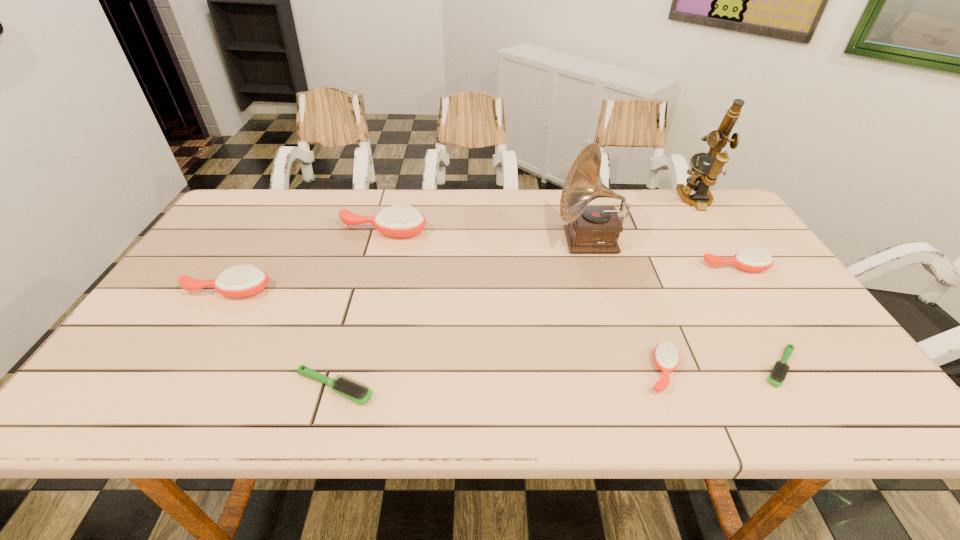
The image size is (960, 540). I want to click on the nearest orange hairbrush, so click(666, 357).

The width and height of the screenshot is (960, 540). Identify the location of the left light hairbrush. (351, 390).

This screenshot has height=540, width=960. Identify the location of the bigger light hairbrush. (351, 390).

Locate an element on the screen. the shortest object is located at coordinates (777, 377).

Image resolution: width=960 pixels, height=540 pixels. I want to click on the right light hairbrush, so click(x=777, y=377).

Image resolution: width=960 pixels, height=540 pixels. I want to click on free spot located on the left of the microscope, so click(x=565, y=201).

The height and width of the screenshot is (540, 960). In order to click on vacant area located 0.120m on the horn of the phonograph record in this screenshot , I will do `click(516, 241)`.

This screenshot has height=540, width=960. In order to click on vacant region located 0.120m on the horn of the phonograph record in this screenshot , I will do `click(516, 241)`.

The width and height of the screenshot is (960, 540). What are the coordinates of `vacant space located on the horn of the phonograph record` in the screenshot? It's located at (483, 241).

Locate an element on the screen. Image resolution: width=960 pixels, height=540 pixels. vacant region located 0.400m on the right of the farthest hairbrush is located at coordinates (558, 232).